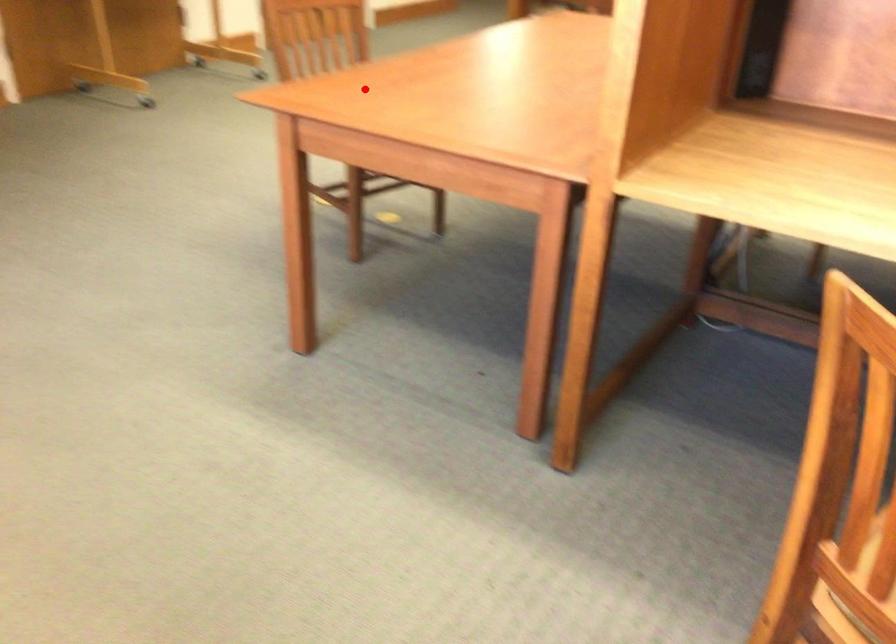
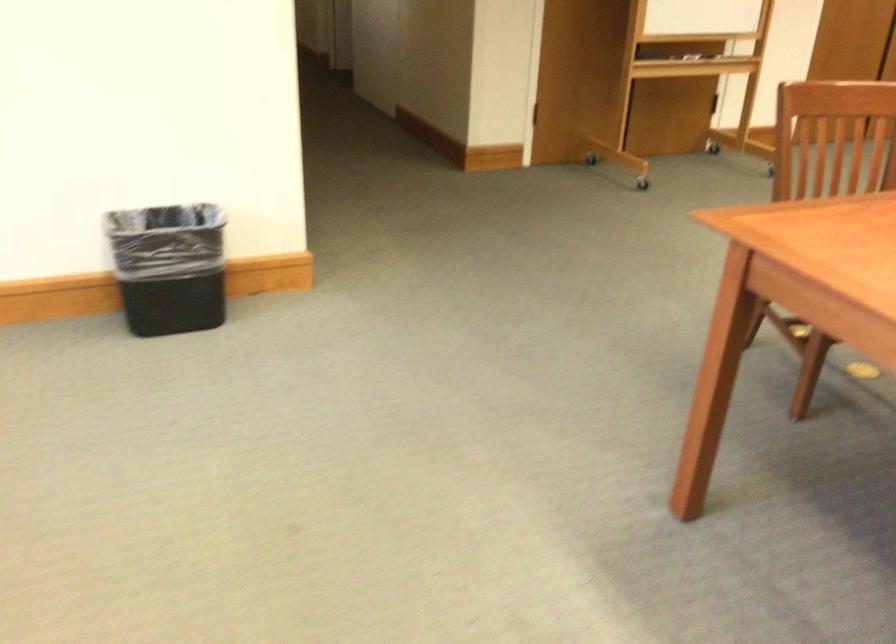
Question: I am providing you with two images of the same scene from different viewpoints. Given a red point in image1, look at the same physical point in image2. Is it:

Choices:
 (A) Closer to the viewpoint
 (B) Farther from the viewpoint

Answer: (A)